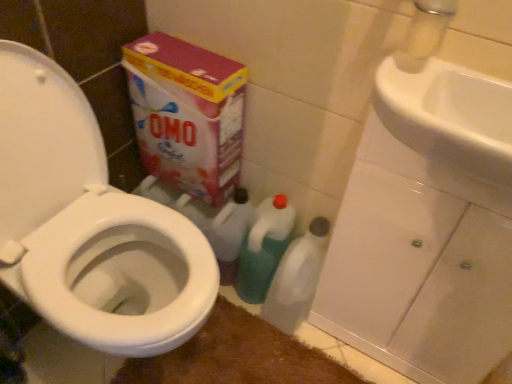
Question: From a real-world perspective, is transparent plastic bottle at lower center, positioned as the 2th cleaning product in left-to-right order, positioned above or below metallic silver faucet at upper right?

Choices:
 (A) below
 (B) above

Answer: (A)

Question: In terms of height, does transparent plastic bottle at lower center, positioned as the 2th cleaning product in left-to-right order, look taller or shorter compared to metallic silver faucet at upper right?

Choices:
 (A) tall
 (B) short

Answer: (A)

Question: Based on their relative distances, which object is farther from the white glossy toilet at left?

Choices:
 (A) metallic silver faucet at upper right
 (B) white glossy sink at upper right
 (C) green plastic bottle at center, which is the 1th cleaning product from left to right
 (D) transparent plastic bottle at lower center, positioned as the 2th cleaning product in left-to-right order
 (E) brown plush bath mat at lower center

Answer: (A)

Question: Which object is positioned farthest from the white glossy toilet at left?

Choices:
 (A) metallic silver faucet at upper right
 (B) white glossy sink at upper right
 (C) transparent plastic bottle at lower center, positioned as the 2th cleaning product in left-to-right order
 (D) multicolored cardboard box at upper left
 (E) green plastic bottle at center, arranged as the second cleaning product when viewed from the right

Answer: (A)